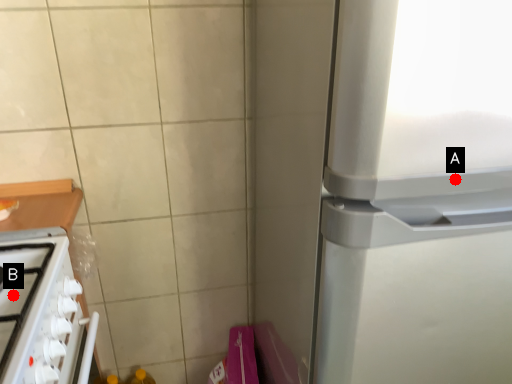
Question: Two points are circled on the image, labeled by A and B beside each circle. Which of the following is the closest to the observer?

Choices:
 (A) A is closer
 (B) B is closer

Answer: (A)